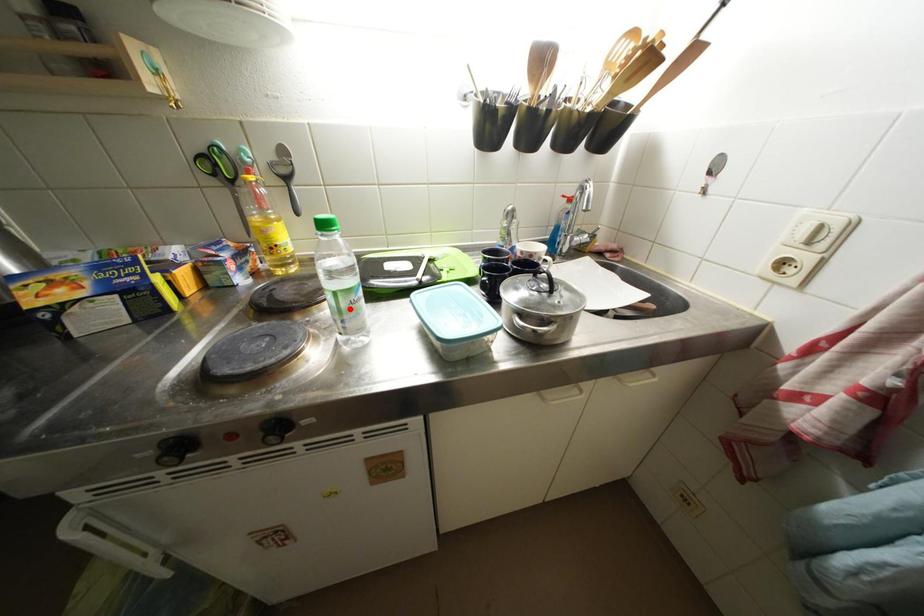
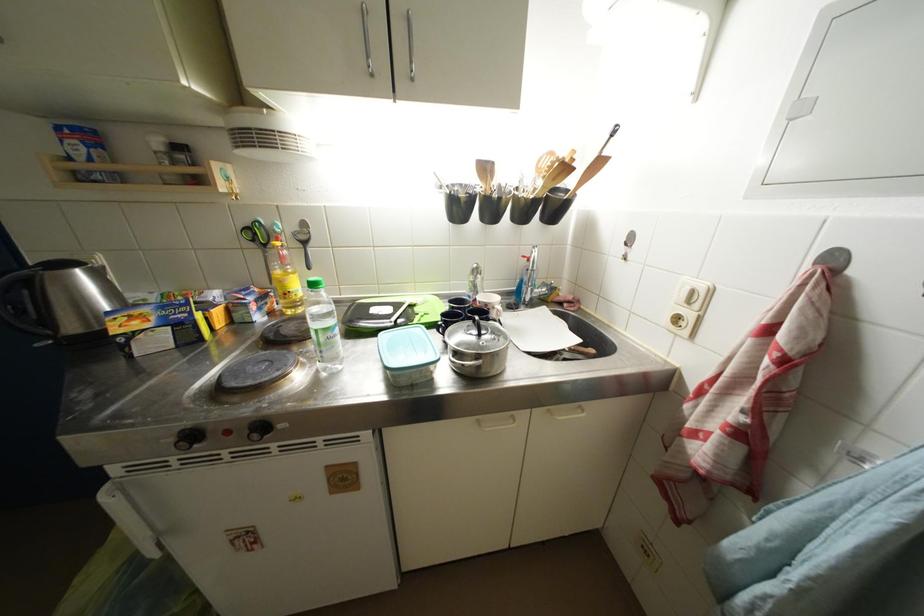
Where in the second image is the point corresponding to the highlighted location from the first image?

(329, 344)